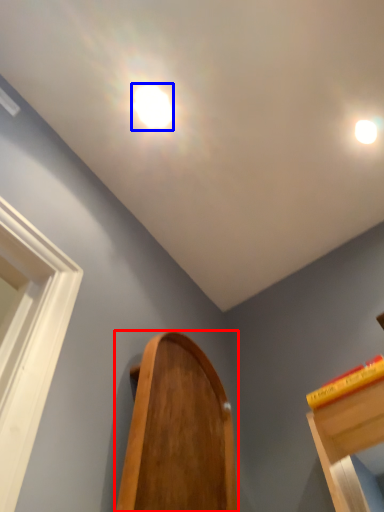
Question: Which object appears farthest to the camera in this image, furniture (highlighted by a red box) or droplight (highlighted by a blue box)?

Choices:
 (A) furniture
 (B) droplight

Answer: (B)